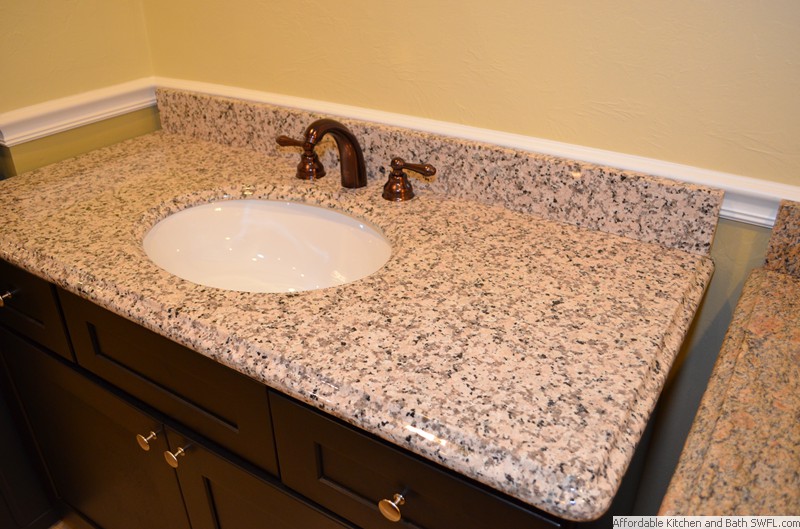
At what (x,y) coordinates should I click in order to perform the action: click on cabinet doors. Please return your answer as a coordinate pair (x, y). Looking at the image, I should click on (86, 462), (229, 501).